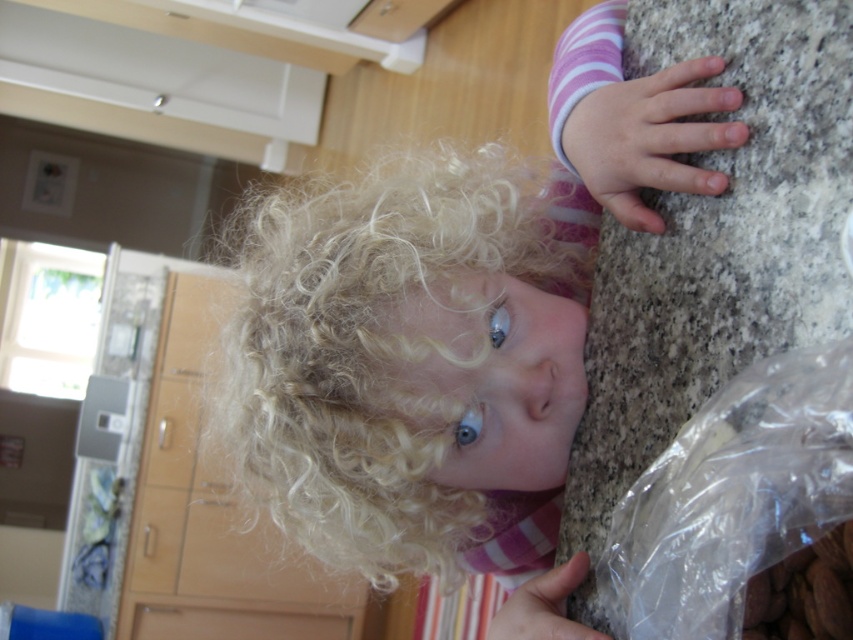
Based on the scene described, which object is taller between the blonde curly hair at upper center and the transparent plastic bag at right?

The blonde curly hair at upper center is taller than the transparent plastic bag at right.

In the kitchen scene, you see a child with blonde curly hair at upper center and a transparent plastic bag at right. Which object is positioned more to the left?

The blonde curly hair at upper center is positioned more to the left than the transparent plastic bag at right.

You are a parent trying to hand a transparent plastic bag at right to your child who has blonde curly hair at upper center. Can you reach the child with the bag without moving either the bag or the child?

The distance between blonde curly hair at upper center and transparent plastic bag at right is 9.73 inches, so yes, you can reach the child with the bag since the distance is short enough to hand it over without moving them.